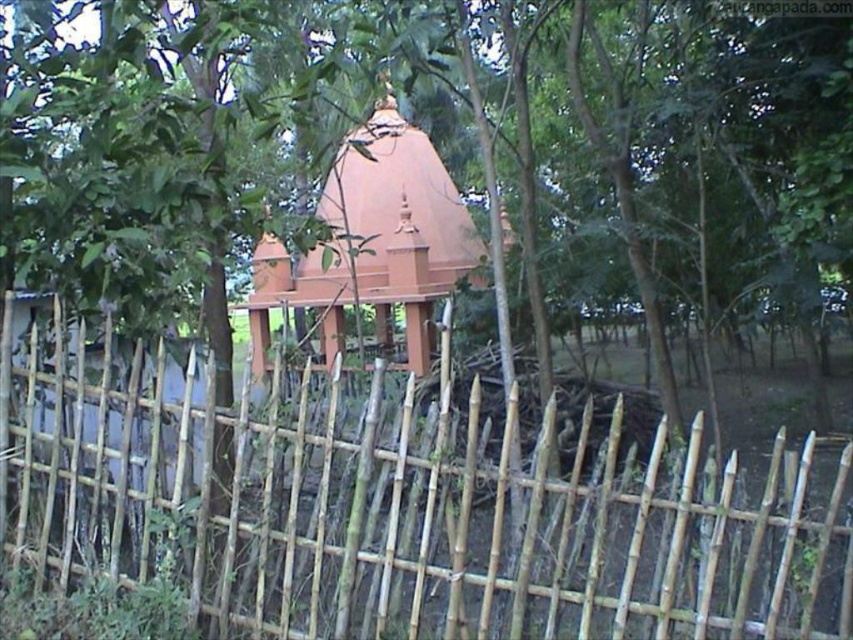
Question: Does bamboo fence at center have a greater width compared to matte orange water tower at center?

Choices:
 (A) yes
 (B) no

Answer: (A)

Question: Among these points, which one is farthest from the camera?

Choices:
 (A) (146, 474)
 (B) (461, 269)

Answer: (B)

Question: Which point is farther to the camera?

Choices:
 (A) (238, 589)
 (B) (408, 192)

Answer: (B)

Question: Does bamboo fence at center appear under matte orange water tower at center?

Choices:
 (A) no
 (B) yes

Answer: (B)

Question: Among these points, which one is farthest from the camera?

Choices:
 (A) (497, 518)
 (B) (421, 141)

Answer: (B)

Question: Is bamboo fence at center closer to camera compared to matte orange water tower at center?

Choices:
 (A) no
 (B) yes

Answer: (B)